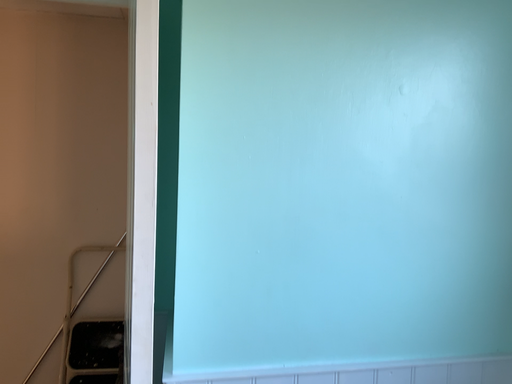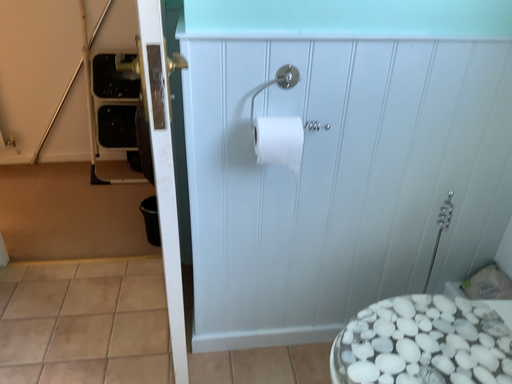
Question: How did the camera likely rotate when shooting the video?

Choices:
 (A) rotated upward
 (B) rotated downward

Answer: (B)